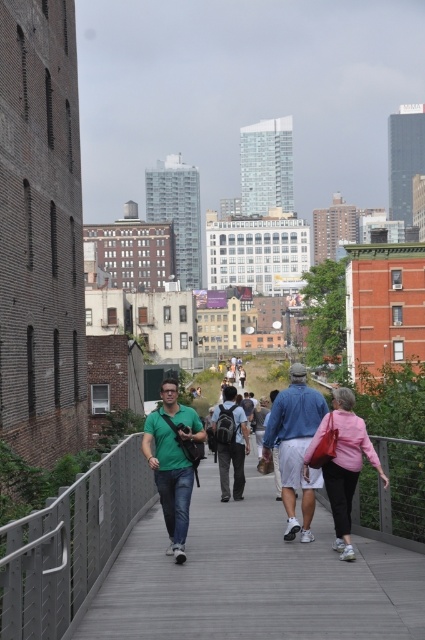
You are standing on the wooden pathway and want to reach the brick building on the left. Which direction should you walk relative to the wooden pathway represented by point (255, 577)?

Walk towards the left side of the wooden pathway represented by point (255, 577) to reach the brick building on the left.

You are standing on the elevated walkway and want to take a photo of both the brick building on the left and the red brick structure with green accents on the right. If you have to choose between focusing on point (142, 442) or point (232, 467) to ensure both buildings are in focus, which point should you choose?

You should focus on point (142, 442) because it is closer to the viewer than point (232, 467), allowing both the brick building on the left and the red brick structure with green accents on the right to be in focus.